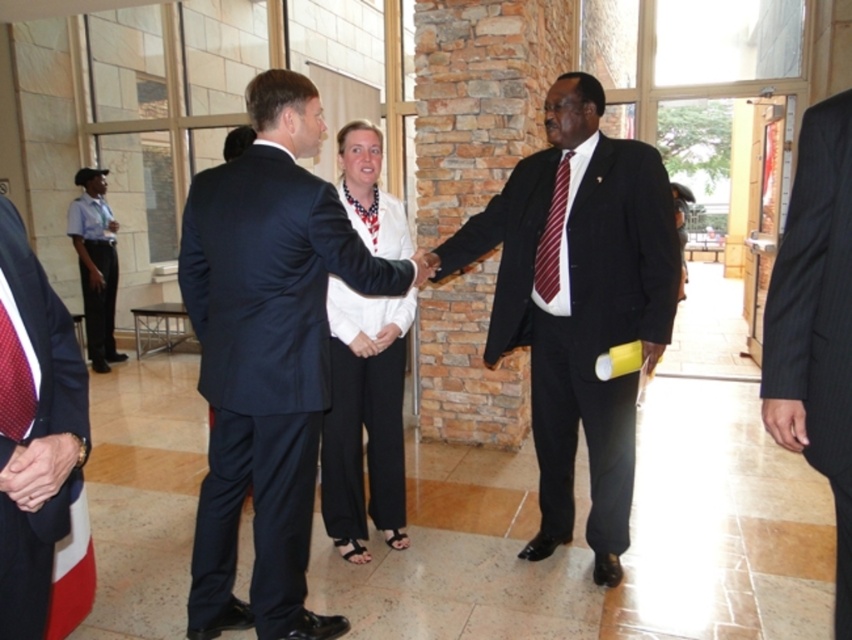
Question: Estimate the real-world distances between objects in this image. Which object is farther from the red dotted tie at left?

Choices:
 (A) black pinstripe suit at center
 (B) maroon striped tie at center
 (C) white fabric shirt at center
 (D) matte black suit at center

Answer: (D)

Question: Is white fabric shirt at center wider than maroon striped tie at center?

Choices:
 (A) no
 (B) yes

Answer: (B)

Question: Which point is farther to the camera?

Choices:
 (A) tap(613, 340)
 (B) tap(547, 232)

Answer: (B)

Question: Considering the real-world distances, which object is closest to the black pinstripe suit at center?

Choices:
 (A) white fabric shirt at center
 (B) dark blue wool suit at center

Answer: (B)

Question: Does dark blue wool suit at center appear on the left side of black pinstripe suit at center?

Choices:
 (A) no
 (B) yes

Answer: (B)

Question: From the image, what is the correct spatial relationship of dark blue wool suit at center in relation to maroon striped tie at center?

Choices:
 (A) right
 (B) left

Answer: (B)